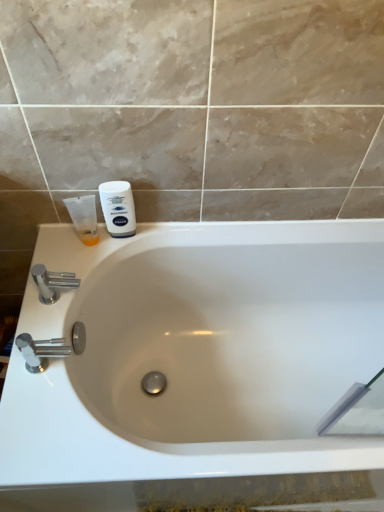
Question: Looking at the image, does translucent orange tube at left, which appears as the 1th shaving cream when viewed from the left, seem bigger or smaller compared to white glossy bathtub at center?

Choices:
 (A) big
 (B) small

Answer: (B)

Question: Which is correct: translucent orange tube at left, which is the 2th shaving cream from right to left, is inside white glossy bathtub at center, or outside of it?

Choices:
 (A) inside
 (B) outside

Answer: (B)

Question: Which of these objects is positioned farthest from the translucent orange tube at left, which is the 2th shaving cream from right to left?

Choices:
 (A) polished chrome faucet at lower left, acting as the 2th tap starting from the top
 (B) white matte shaving cream at upper left, the 2th shaving cream viewed from the left
 (C) chrome metallic faucet at left, the second tap when ordered from bottom to top
 (D) white glossy bathtub at center

Answer: (D)

Question: Based on their relative distances, which object is farther from the polished chrome faucet at lower left, which appears as the first tap when viewed from the front?

Choices:
 (A) white glossy bathtub at center
 (B) chrome metallic faucet at left, arranged as the 1th tap when viewed from the back
 (C) white matte shaving cream at upper left, arranged as the first shaving cream when viewed from the right
 (D) translucent orange tube at left, which appears as the 1th shaving cream when viewed from the left

Answer: (A)